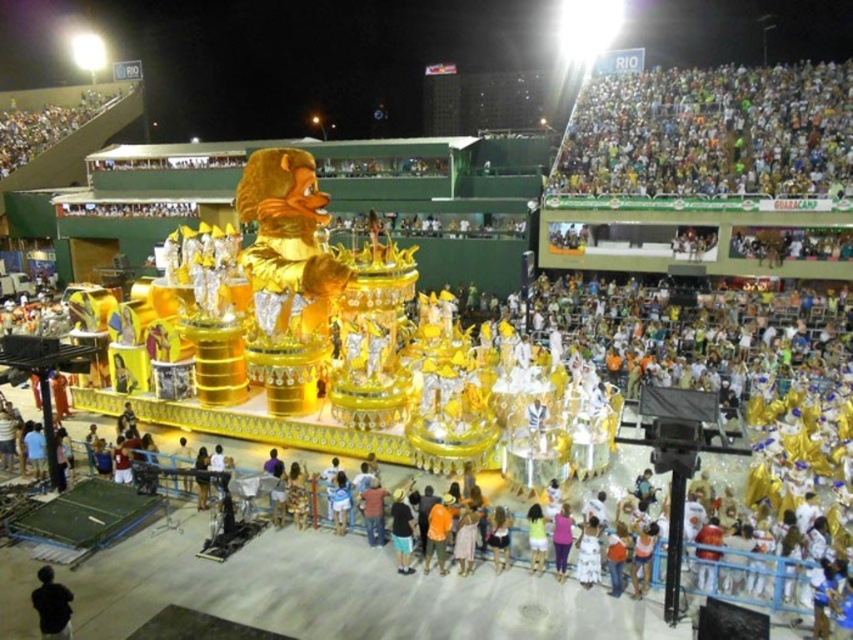
Which is more to the right, white cloth crowd at upper right or black matte jacket at lower left?

From the viewer's perspective, white cloth crowd at upper right appears more on the right side.

Between white cloth crowd at upper right and black matte jacket at lower left, which one is positioned lower?

black matte jacket at lower left is lower down.

Who is more distant from viewer, (730, 152) or (41, 625)?

The point (730, 152) is behind.

This screenshot has width=853, height=640. What are the coordinates of `white cloth crowd at upper right` in the screenshot? It's located at (711, 132).